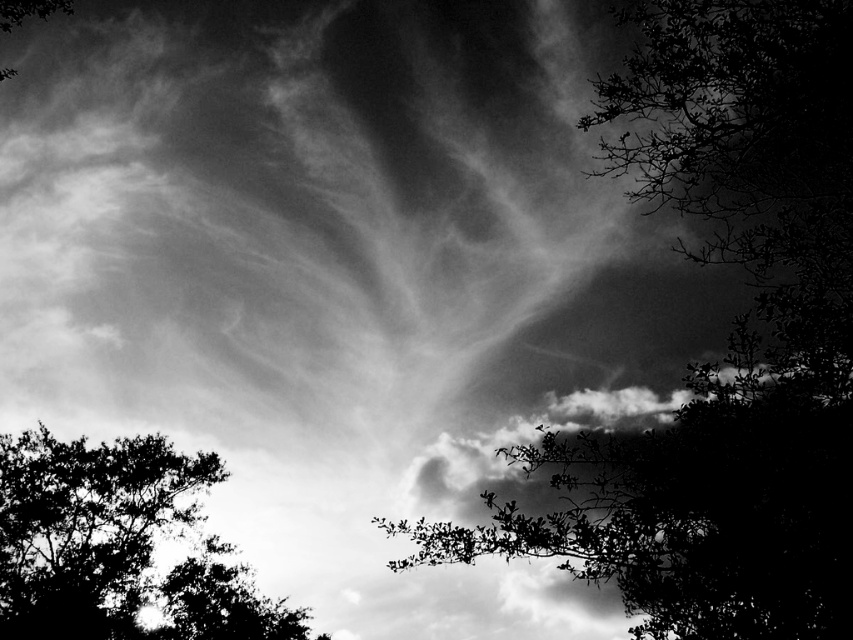
Question: Considering the relative positions of silhouette leafy branch at upper right and dark leafy tree at lower left in the image provided, where is silhouette leafy branch at upper right located with respect to dark leafy tree at lower left?

Choices:
 (A) above
 (B) below

Answer: (A)

Question: Which object appears farthest from the camera in this image?

Choices:
 (A) dark leafy tree at lower left
 (B) silhouette leafy branch at upper right

Answer: (A)

Question: Can you confirm if silhouette leafy branch at upper right is smaller than dark leafy tree at lower left?

Choices:
 (A) no
 (B) yes

Answer: (B)

Question: Is silhouette leafy branch at upper right to the left of dark leafy tree at lower left from the viewer's perspective?

Choices:
 (A) no
 (B) yes

Answer: (A)